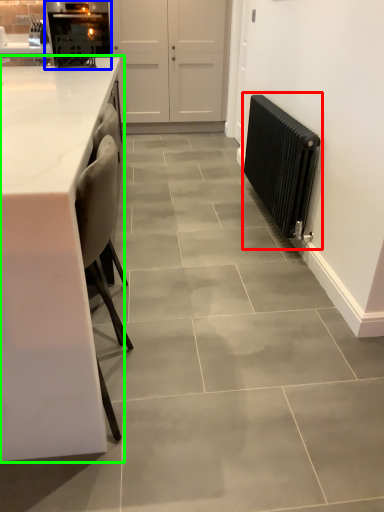
Question: Which object is the farthest from radiator (highlighted by a red box)? Choose among these: appliance (highlighted by a blue box) or countertop (highlighted by a green box).

Choices:
 (A) appliance
 (B) countertop

Answer: (A)